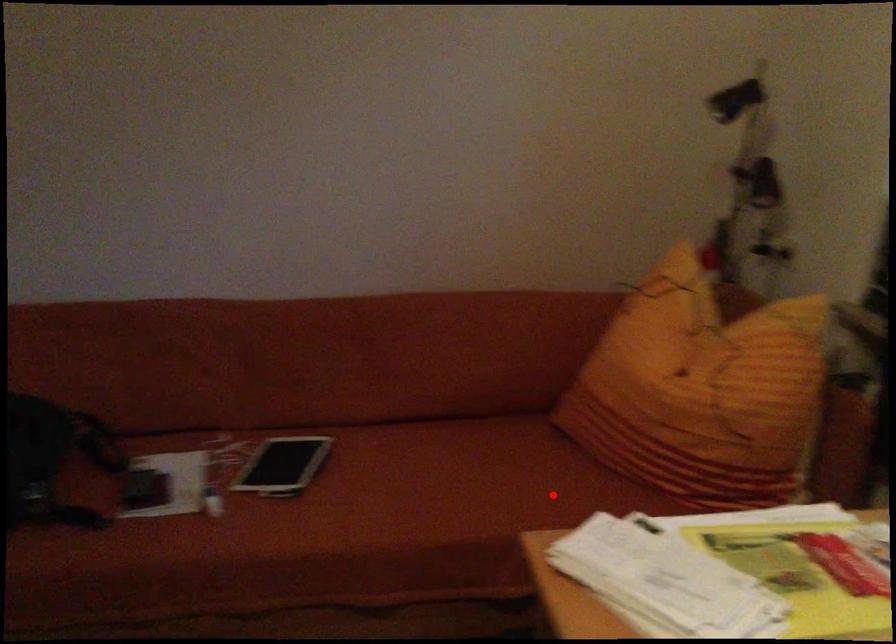
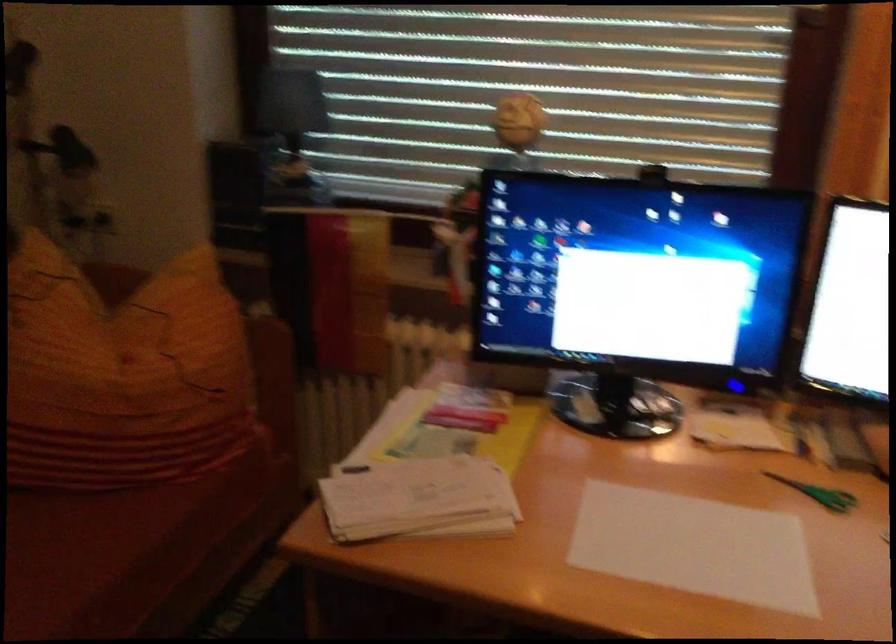
Locate, in the second image, the point that corresponds to the highlighted location in the first image.

(66, 556)